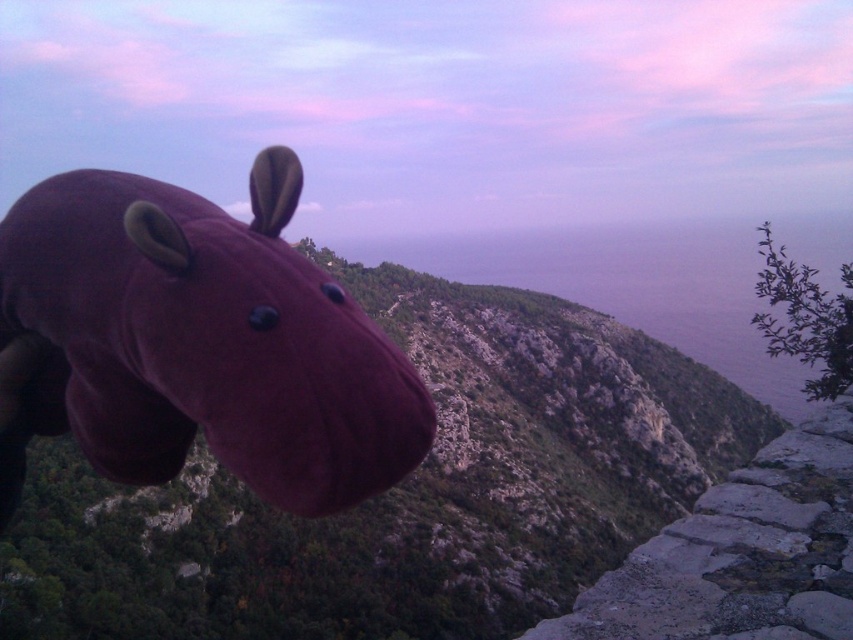
You are a child who wants to place the velvet purple hippo at left on a shelf next to the gray stone cliff at lower right. Based on their heights, will the hippo be shorter than the cliff?

The velvet purple hippo at left is not as tall as gray stone cliff at lower right, so yes, the hippo will be shorter than the cliff when placed on the shelf.

You are standing in front of the image and want to touch the two points mentioned. Which point, point (10, 461) or point (799, 435), will you reach first if you move your hand forward?

Point (10, 461) is closer to the viewer than point (799, 435), so you will reach point (10, 461) first.